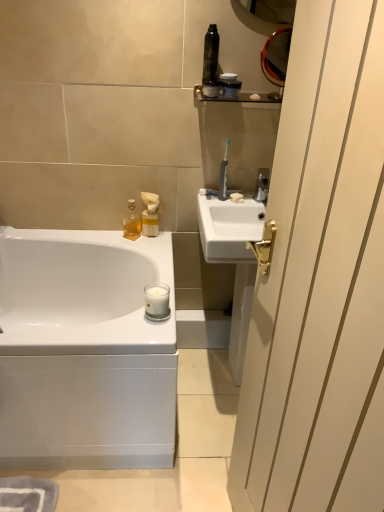
Question: Is white glossy screen door at right turned away from metallic silver shelf at upper center?

Choices:
 (A) no
 (B) yes

Answer: (A)

Question: Is there a large distance between white glossy screen door at right and metallic silver shelf at upper center?

Choices:
 (A) yes
 (B) no

Answer: (B)

Question: From a real-world perspective, is white glossy screen door at right on metallic silver shelf at upper center?

Choices:
 (A) no
 (B) yes

Answer: (A)

Question: Does white glossy screen door at right have a greater height compared to metallic silver shelf at upper center?

Choices:
 (A) no
 (B) yes

Answer: (B)

Question: Is white glossy screen door at right completely or partially outside of metallic silver shelf at upper center?

Choices:
 (A) yes
 (B) no

Answer: (A)

Question: Is shiny black canister at upper center, which is counted as the 2th toiletry, starting from the right, to the left or to the right of white glossy bathtub at lower left in the image?

Choices:
 (A) left
 (B) right

Answer: (B)

Question: In terms of height, does shiny black canister at upper center, placed as the 2th toiletry when sorted from left to right, look taller or shorter compared to white glossy bathtub at lower left?

Choices:
 (A) short
 (B) tall

Answer: (A)

Question: In the image, is shiny black canister at upper center, placed as the first toiletry when sorted from top to bottom, positioned in front of or behind white glossy bathtub at lower left?

Choices:
 (A) behind
 (B) front

Answer: (A)

Question: From a real-world perspective, is shiny black canister at upper center, the third toiletry from the back, physically located above or below white glossy bathtub at lower left?

Choices:
 (A) below
 (B) above

Answer: (B)

Question: Looking at the image, does white glossy screen door at right seem bigger or smaller compared to white plastic toothbrush at upper right?

Choices:
 (A) big
 (B) small

Answer: (A)

Question: In terms of height, does white glossy screen door at right look taller or shorter compared to white plastic toothbrush at upper right?

Choices:
 (A) tall
 (B) short

Answer: (A)

Question: From a real-world perspective, is white glossy screen door at right above or below white plastic toothbrush at upper right?

Choices:
 (A) above
 (B) below

Answer: (B)

Question: In the image, is white glossy screen door at right on the left side or the right side of white plastic toothbrush at upper right?

Choices:
 (A) left
 (B) right

Answer: (B)

Question: From a real-world perspective, is shiny black canister at upper center, which is counted as the 2th toiletry, starting from the right, physically located above or below satin black container at upper center, which appears as the 2th toiletry when viewed from the front?

Choices:
 (A) below
 (B) above

Answer: (B)

Question: Relative to satin black container at upper center, which is the 2th toiletry in top-to-bottom order, is shiny black canister at upper center, which is counted as the third toiletry, starting from the bottom, in front or behind?

Choices:
 (A) behind
 (B) front

Answer: (B)